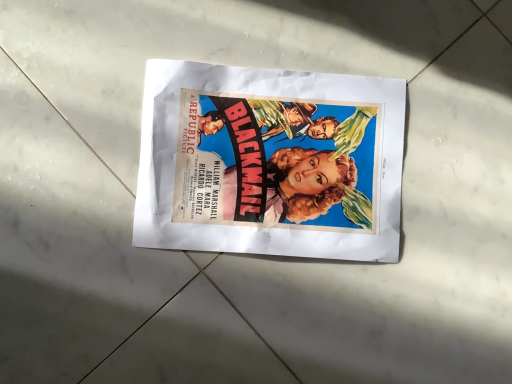
The image size is (512, 384). What do you see at coordinates (270, 162) in the screenshot?
I see `matte paper poster at center` at bounding box center [270, 162].

Find the location of `matte paper poster at center`. matte paper poster at center is located at coordinates (270, 162).

Measure the distance between point (x=369, y=107) and camera.

The depth of point (x=369, y=107) is 48.40 centimeters.

The height and width of the screenshot is (384, 512). Identify the location of matte paper poster at center. (270, 162).